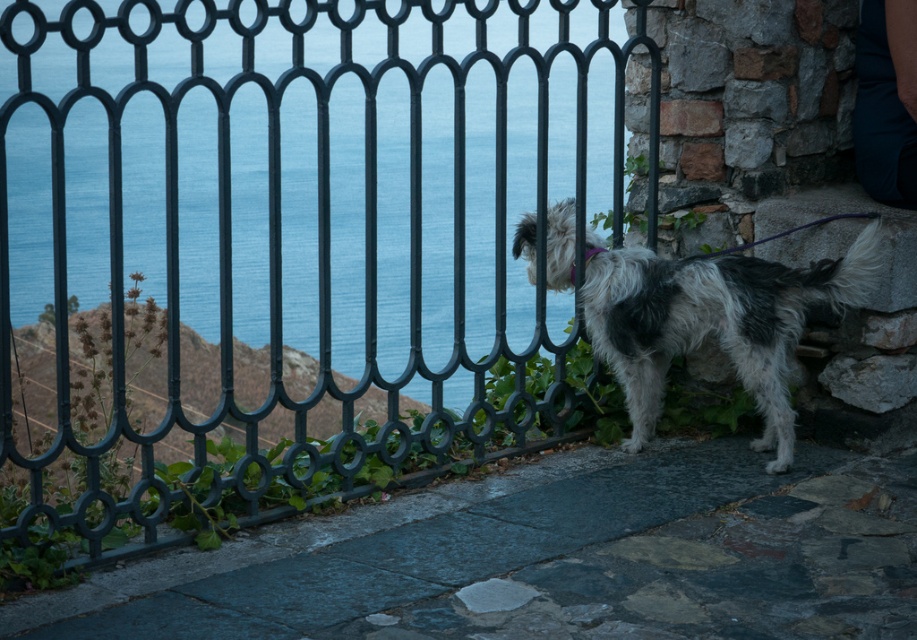
Can you confirm if black wrought iron fence at upper center is positioned above white-furred dog at center?

Correct, black wrought iron fence at upper center is located above white-furred dog at center.

Is the position of black wrought iron fence at upper center less distant than that of white-furred dog at center?

Yes, it is in front of white-furred dog at center.

Identify the location of black wrought iron fence at upper center. This screenshot has height=640, width=917. (290, 246).